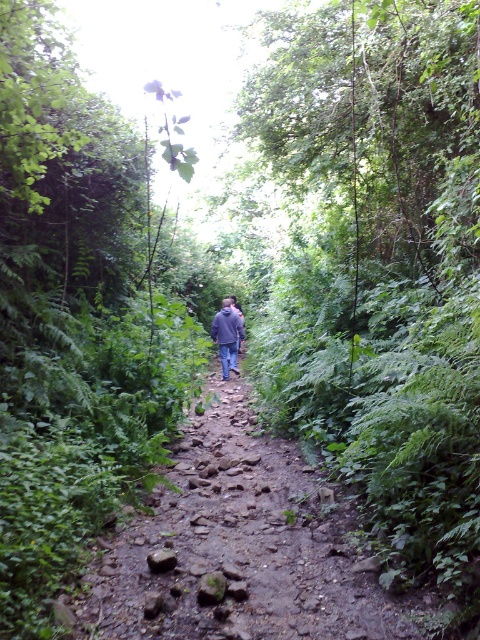
How much distance is there between dusty stone path at center and dark blue jeans at center?

dusty stone path at center and dark blue jeans at center are 4.61 meters apart.

Is point (239, 602) less distant than point (228, 339)?

Yes, it is.

This screenshot has width=480, height=640. What do you see at coordinates (238, 547) in the screenshot? I see `dusty stone path at center` at bounding box center [238, 547].

Image resolution: width=480 pixels, height=640 pixels. I want to click on dusty stone path at center, so click(238, 547).